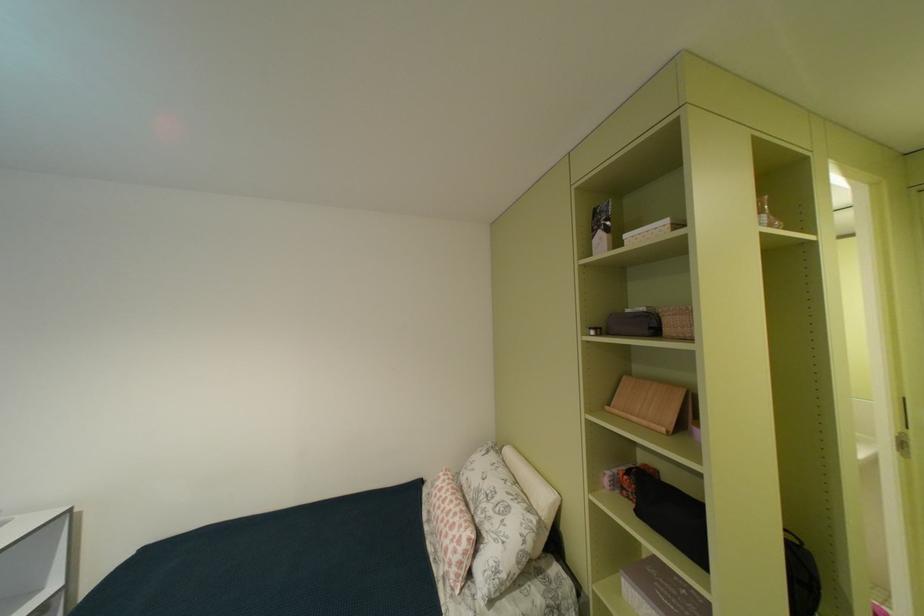
Image resolution: width=924 pixels, height=616 pixels. What are the coordinates of `wicker basket` in the screenshot? It's located at (676, 322).